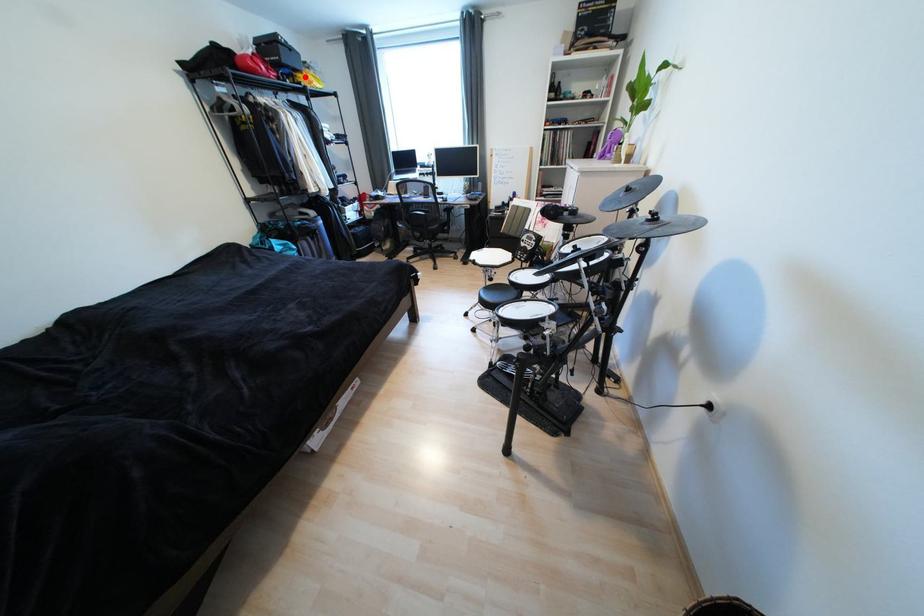
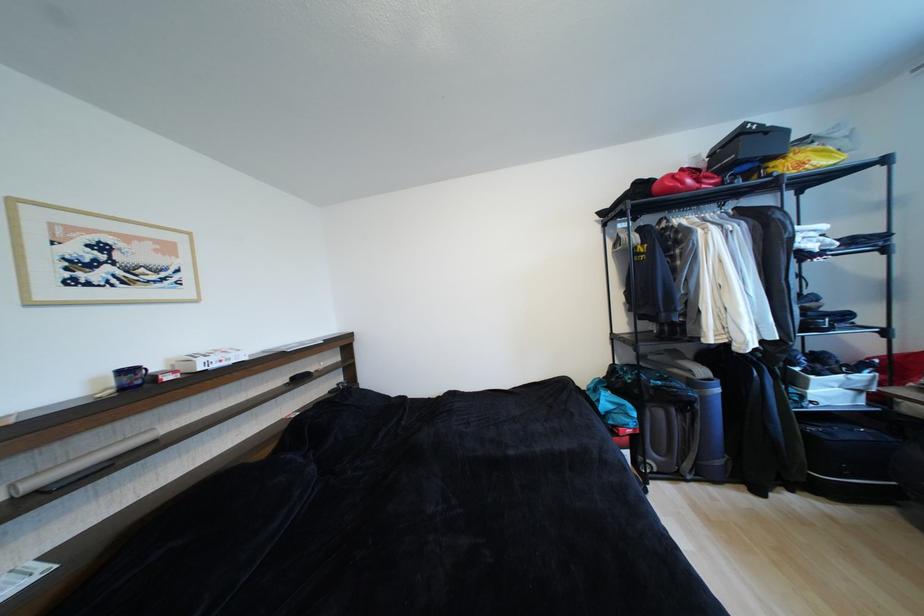
In the second image, find the point that corresponds to the highlighted location in the first image.

(780, 166)